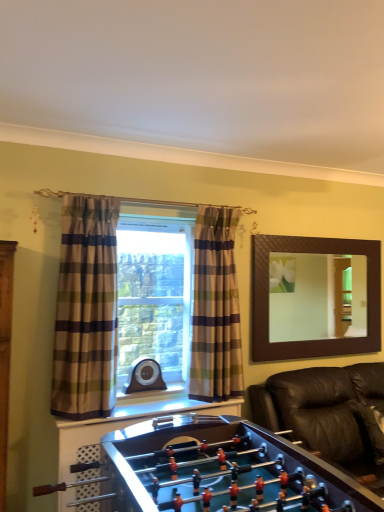
Question: Could you tell me if plaid fabric curtain at left, the 2th curtain in the back-to-front sequence, is turned towards brown textured mirror at upper right?

Choices:
 (A) yes
 (B) no

Answer: (B)

Question: Is plaid fabric curtain at left, the 2th curtain in the back-to-front sequence, wider than brown textured mirror at upper right?

Choices:
 (A) yes
 (B) no

Answer: (A)

Question: Is plaid fabric curtain at left, which is the second curtain from right to left, to the left of brown textured mirror at upper right from the viewer's perspective?

Choices:
 (A) yes
 (B) no

Answer: (A)

Question: From the image's perspective, is plaid fabric curtain at left, which is the second curtain from right to left, over brown textured mirror at upper right?

Choices:
 (A) yes
 (B) no

Answer: (A)

Question: Is plaid fabric curtain at left, the 2th curtain in the back-to-front sequence, bigger than brown textured mirror at upper right?

Choices:
 (A) no
 (B) yes

Answer: (B)

Question: Is plaid fabric curtain at left, the 1th curtain viewed from the left, positioned with its back to brown textured mirror at upper right?

Choices:
 (A) no
 (B) yes

Answer: (A)

Question: Is black leather couch at lower right wider than plaid fabric curtain at left, placed as the 1th curtain when sorted from front to back?

Choices:
 (A) no
 (B) yes

Answer: (B)

Question: Is black leather couch at lower right at the right side of plaid fabric curtain at left, which is the second curtain from right to left?

Choices:
 (A) yes
 (B) no

Answer: (A)

Question: Is black leather couch at lower right bigger than plaid fabric curtain at left, which is the second curtain from right to left?

Choices:
 (A) no
 (B) yes

Answer: (B)

Question: From a real-world perspective, is black leather couch at lower right physically above plaid fabric curtain at left, placed as the 1th curtain when sorted from front to back?

Choices:
 (A) no
 (B) yes

Answer: (A)

Question: From a real-world perspective, is black leather couch at lower right physically below plaid fabric curtain at left, the 1th curtain viewed from the left?

Choices:
 (A) no
 (B) yes

Answer: (B)

Question: Does black leather couch at lower right have a lesser width compared to plaid fabric curtain at left, the 2th curtain in the back-to-front sequence?

Choices:
 (A) yes
 (B) no

Answer: (B)

Question: Does plaid fabric curtain at center, positioned as the 2th curtain in front-to-back order, have a greater width compared to brown textured mirror at upper right?

Choices:
 (A) no
 (B) yes

Answer: (B)